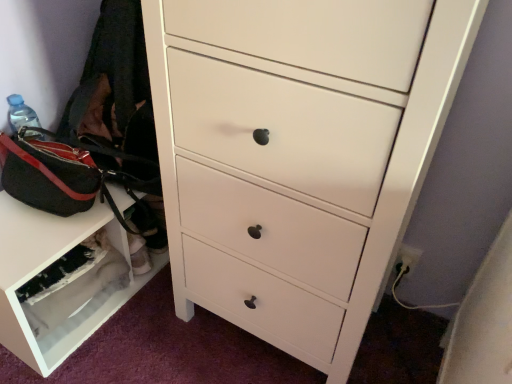
The image size is (512, 384). I want to click on unoccupied area in front of white matte shoe rack at lower left, so click(76, 365).